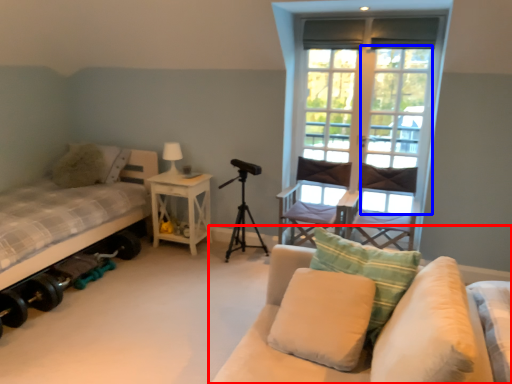
Question: Which of the following is the closest to the observer, studio couch (highlighted by a red box) or screen door (highlighted by a blue box)?

Choices:
 (A) studio couch
 (B) screen door

Answer: (A)